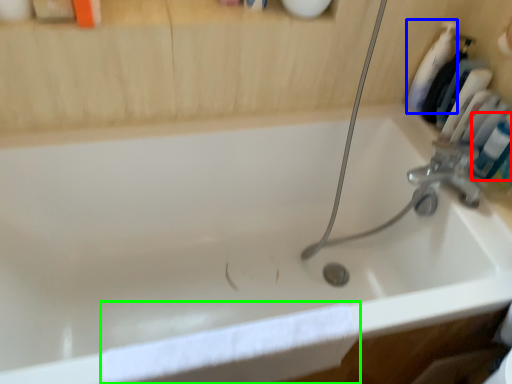
Question: Which object is positioned farthest from mouthwash (highlighted by a red box)? Select from cleaning product (highlighted by a blue box) and bath towel (highlighted by a green box).

Choices:
 (A) cleaning product
 (B) bath towel

Answer: (B)